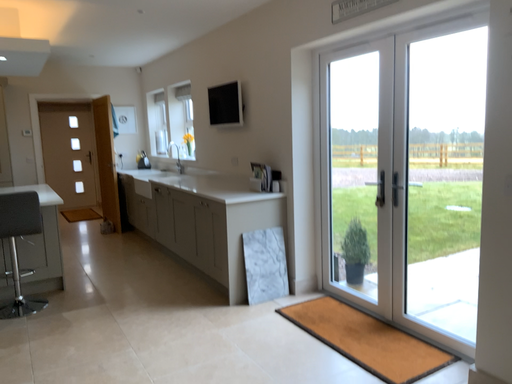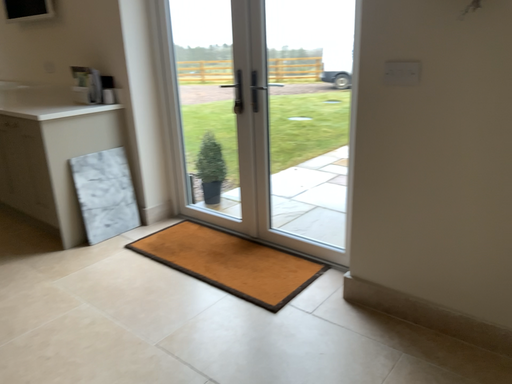
Question: How did the camera likely rotate when shooting the video?

Choices:
 (A) rotated left
 (B) rotated right

Answer: (B)